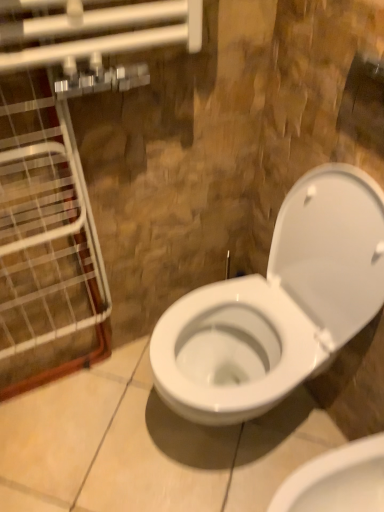
Question: Is clear glass door at left in front of or behind white glossy toilet at center, the second toilet from the bottom, in the image?

Choices:
 (A) front
 (B) behind

Answer: (A)

Question: From a real-world perspective, is clear glass door at left physically located above or below white glossy toilet at center, the second toilet from the bottom?

Choices:
 (A) above
 (B) below

Answer: (A)

Question: Estimate the real-world distances between objects in this image. Which object is closer to the clear glass door at left?

Choices:
 (A) white glossy toilet at center, the second toilet from the bottom
 (B) white glossy toilet at center, the first toilet ordered from the bottom

Answer: (A)

Question: Which object is the farthest from the white glossy toilet at center, the second toilet from the bottom?

Choices:
 (A) white glossy toilet at center, acting as the second toilet starting from the top
 (B) clear glass door at left

Answer: (B)